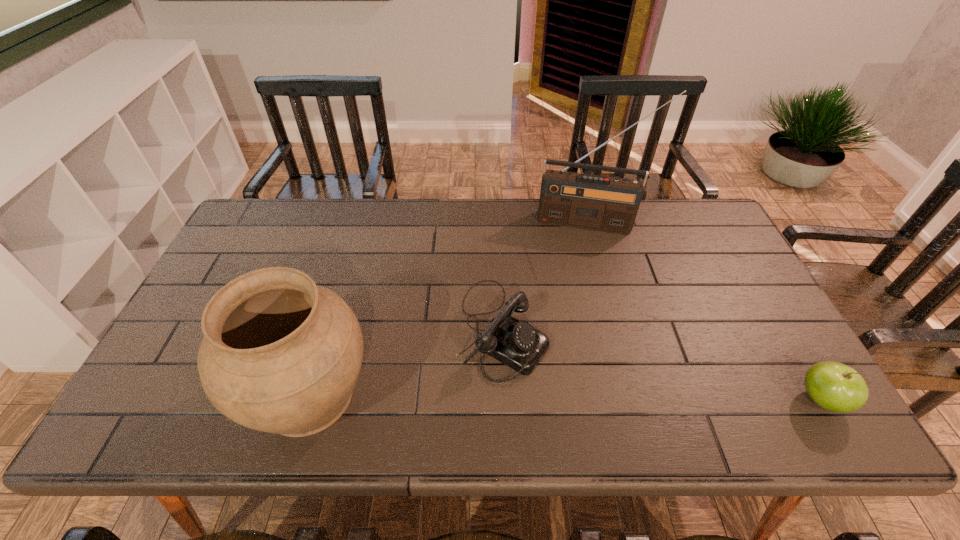
Locate an element on the screen. This screenshot has height=540, width=960. vacant space on the desktop that is between the urn and the rightmost object and is positioned on the front-facing side of the second object from left to right is located at coordinates (631, 398).

The image size is (960, 540). What are the coordinates of `vacant space on the desktop that is between the leftmost object and the rightmost object and is positioned on the front-facing side of the radio receiver` in the screenshot? It's located at (575, 397).